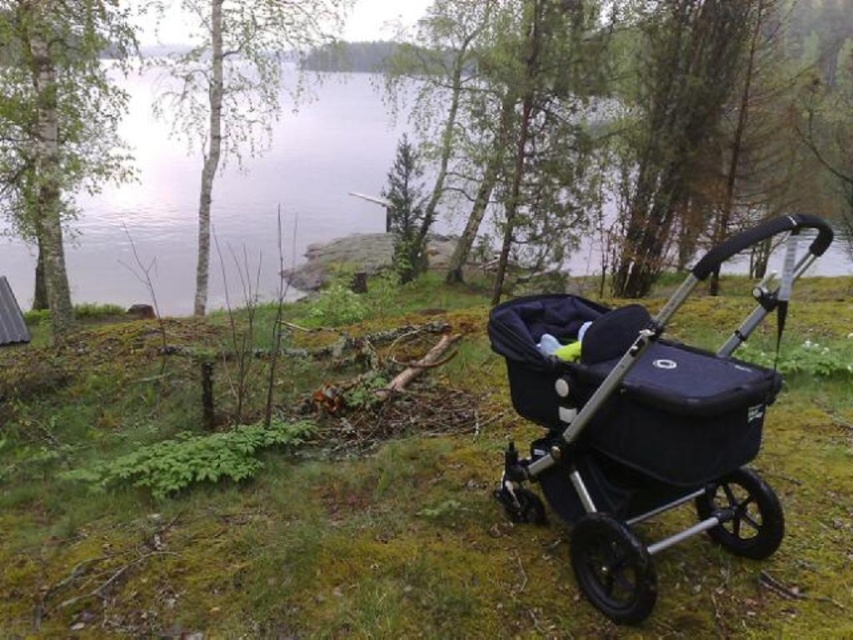
Is black fabric stroller at center wider than clear water at center?

No, black fabric stroller at center is not wider than clear water at center.

Consider the image. Which is more to the right, black fabric stroller at center or clear water at center?

black fabric stroller at center is more to the right.

This screenshot has width=853, height=640. What are the coordinates of `black fabric stroller at center` in the screenshot? It's located at coord(642,426).

Locate an element on the screen. black fabric stroller at center is located at coordinates (642, 426).

Does green mossy grass at lower right have a greater height compared to black fabric stroller at center?

No, green mossy grass at lower right is not taller than black fabric stroller at center.

Does green mossy grass at lower right have a lesser height compared to black fabric stroller at center?

Yes.

Is point (82, 600) positioned behind point (503, 326)?

No, (82, 600) is closer to viewer.

Where is `green mossy grass at lower right`? green mossy grass at lower right is located at coordinates (416, 547).

Which is more to the right, green mossy grass at lower right or clear water at center?

clear water at center is more to the right.

Is point (115, 552) closer to camera compared to point (445, 225)?

That is True.

Where is `green mossy grass at lower right`? The height and width of the screenshot is (640, 853). green mossy grass at lower right is located at coordinates (416, 547).

Identify the location of green mossy grass at lower right. (416, 547).